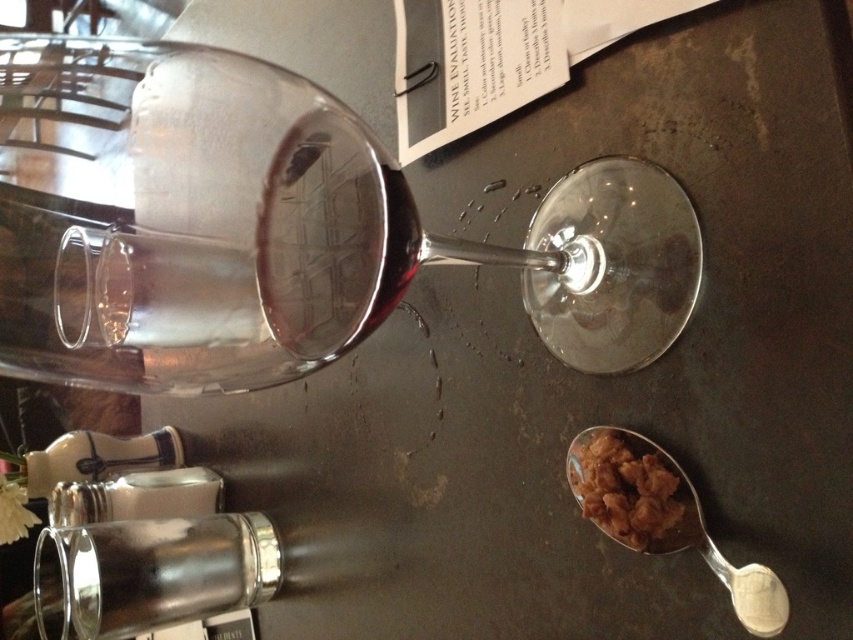
Question: Which object appears closest to the camera in this image?

Choices:
 (A) silver metallic spoon at lower right
 (B) transparent glass at upper center

Answer: (A)

Question: Does transparent glass at upper center appear on the right side of silver metallic spoon at lower right?

Choices:
 (A) yes
 (B) no

Answer: (B)

Question: Among these points, which one is farthest from the camera?

Choices:
 (A) (395, 216)
 (B) (111, 536)
 (C) (692, 536)
 (D) (666, 541)

Answer: (B)

Question: Observing the image, what is the correct spatial positioning of transparent glass at upper center in reference to brown crumbly snack at lower right?

Choices:
 (A) right
 (B) left

Answer: (B)

Question: Which point is farther to the camera?

Choices:
 (A) silver metallic spoon at lower right
 (B) silver metallic bottle at lower left

Answer: (B)

Question: Can you confirm if silver metallic bottle at lower left is positioned to the right of brown crumbly snack at lower right?

Choices:
 (A) no
 (B) yes

Answer: (A)